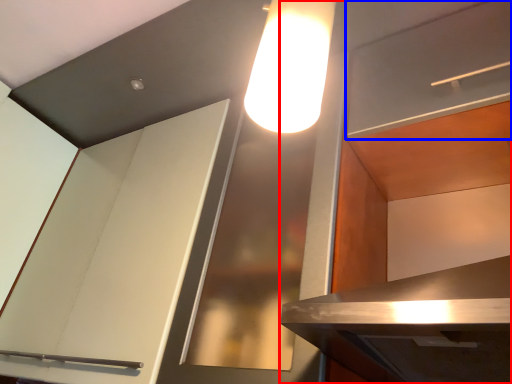
Question: Which of the following is the closest to the observer, cabinetry (highlighted by a red box) or shelf (highlighted by a blue box)?

Choices:
 (A) cabinetry
 (B) shelf

Answer: (A)